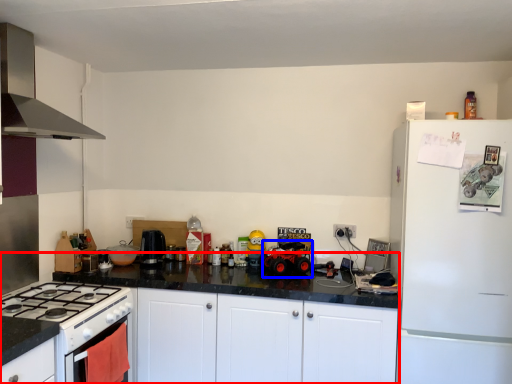
Question: Which object is closer to the camera taking this photo, counter (highlighted by a red box) or toy car (highlighted by a blue box)?

Choices:
 (A) counter
 (B) toy car

Answer: (A)